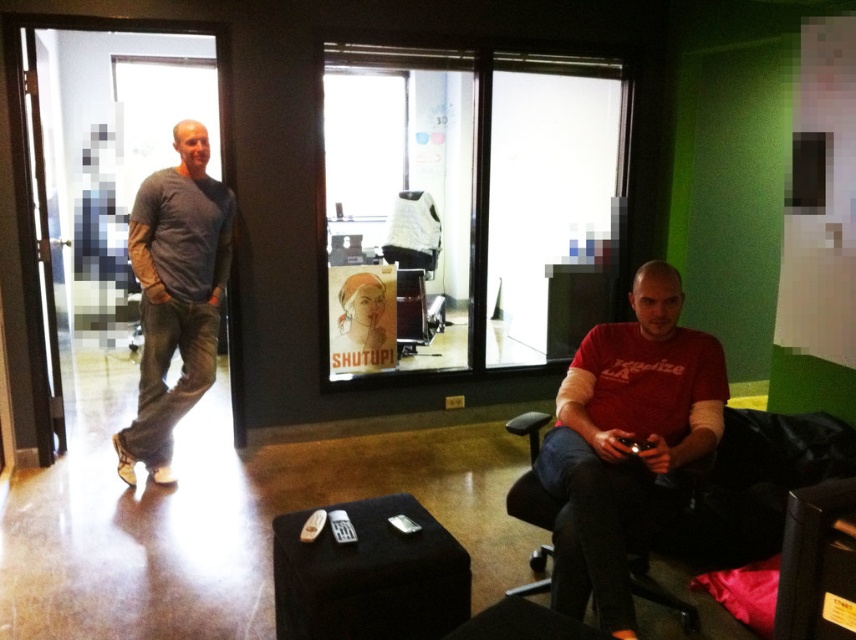
Question: Which object is closer to the camera taking this photo?

Choices:
 (A) black leather armchair at right
 (B) black fabric stool at lower center
 (C) gray cotton shirt at left
 (D) transparent glass door at left

Answer: (B)

Question: Which of the following is the closest to the observer?

Choices:
 (A) black fabric stool at lower center
 (B) gray cotton shirt at left
 (C) transparent glass door at left

Answer: (A)

Question: From the image, what is the correct spatial relationship of gray cotton shirt at left in relation to black fabric stool at lower center?

Choices:
 (A) left
 (B) right

Answer: (A)

Question: Does transparent glass door at left appear on the left side of gray cotton shirt at left?

Choices:
 (A) yes
 (B) no

Answer: (A)

Question: Which object appears closest to the camera in this image?

Choices:
 (A) black fabric stool at lower center
 (B) transparent glass door at left

Answer: (A)

Question: Is gray cotton shirt at left above black leather armchair at right?

Choices:
 (A) yes
 (B) no

Answer: (A)